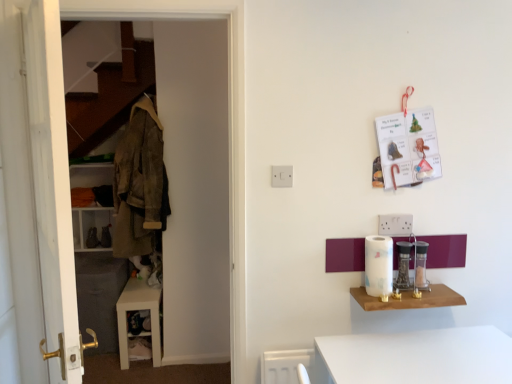
Question: Can you confirm if white wooden dresser at left is shorter than clear glass jar at right, which is the 3th appliance from left to right?

Choices:
 (A) yes
 (B) no

Answer: (B)

Question: Is white wooden dresser at left in contact with clear glass jar at right, the first appliance from the right?

Choices:
 (A) no
 (B) yes

Answer: (A)

Question: Is white wooden dresser at left to the left of clear glass jar at right, the first appliance from the right, from the viewer's perspective?

Choices:
 (A) no
 (B) yes

Answer: (B)

Question: Is white wooden dresser at left positioned with its back to clear glass jar at right, the first appliance from the right?

Choices:
 (A) yes
 (B) no

Answer: (B)

Question: From a real-world perspective, does white wooden dresser at left stand above clear glass jar at right, which is the 3th appliance from left to right?

Choices:
 (A) yes
 (B) no

Answer: (A)

Question: Considering the positions of point (367, 291) and point (274, 170), is point (367, 291) closer or farther from the camera than point (274, 170)?

Choices:
 (A) farther
 (B) closer

Answer: (A)

Question: From the image's perspective, is white paper towel at right, which appears as the 1th appliance when viewed from the left, above or below white plastic electric outlet at center?

Choices:
 (A) below
 (B) above

Answer: (A)

Question: Is white paper towel at right, which appears as the 3th appliance when viewed from the right, bigger or smaller than white plastic electric outlet at center?

Choices:
 (A) small
 (B) big

Answer: (B)

Question: From their relative heights in the image, would you say white paper towel at right, which appears as the 3th appliance when viewed from the right, is taller or shorter than white plastic electric outlet at center?

Choices:
 (A) tall
 (B) short

Answer: (A)

Question: From the image's perspective, is white glossy paper towel holder at right, which is the second appliance in left-to-right order, located above or below white glossy cabinet at lower left?

Choices:
 (A) below
 (B) above

Answer: (B)

Question: Considering the positions of point (x=404, y=283) and point (x=124, y=347), is point (x=404, y=283) closer or farther from the camera than point (x=124, y=347)?

Choices:
 (A) closer
 (B) farther

Answer: (A)

Question: Is white glossy paper towel holder at right, which appears as the second appliance when viewed from the right, bigger or smaller than white glossy cabinet at lower left?

Choices:
 (A) small
 (B) big

Answer: (A)

Question: From a real-world perspective, relative to white glossy cabinet at lower left, is white glossy paper towel holder at right, which appears as the second appliance when viewed from the right, vertically above or below?

Choices:
 (A) above
 (B) below

Answer: (A)

Question: Is wooden shelf at lower right in front of or behind clear glass jar at right, the first appliance from the right, in the image?

Choices:
 (A) behind
 (B) front

Answer: (B)

Question: Considering the positions of wooden shelf at lower right and clear glass jar at right, the first appliance from the right, in the image, is wooden shelf at lower right wider or thinner than clear glass jar at right, the first appliance from the right,?

Choices:
 (A) wide
 (B) thin

Answer: (A)